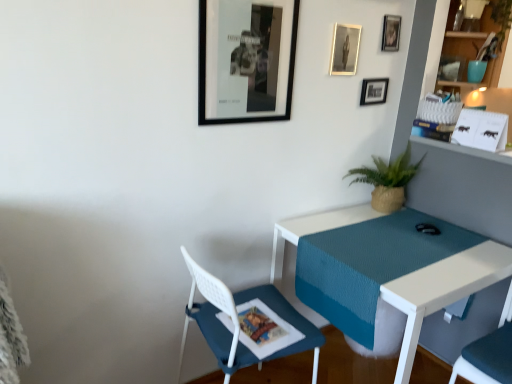
Question: From the image's perspective, is white textured desk at center located beneath black matte picture frame at upper center, the first picture frame when ordered from front to back?

Choices:
 (A) no
 (B) yes

Answer: (B)

Question: Is the depth of white textured desk at center greater than that of black matte picture frame at upper center, the first picture frame when ordered from front to back?

Choices:
 (A) no
 (B) yes

Answer: (A)

Question: Is white textured desk at center not close to black matte picture frame at upper center, which is the 4th picture frame in right-to-left order?

Choices:
 (A) no
 (B) yes

Answer: (A)

Question: Considering the relative sizes of white textured desk at center and black matte picture frame at upper center, which is the 4th picture frame in right-to-left order, in the image provided, is white textured desk at center taller than black matte picture frame at upper center, which is the 4th picture frame in right-to-left order,?

Choices:
 (A) yes
 (B) no

Answer: (A)

Question: Can we say white textured desk at center lies outside black matte picture frame at upper center, the first picture frame when ordered from front to back?

Choices:
 (A) no
 (B) yes

Answer: (B)

Question: In terms of height, does black matte picture frame at upper center, the first picture frame when ordered from front to back, look taller or shorter compared to metallic silver photo frame at upper center, which appears as the 3th picture frame when viewed from the right?

Choices:
 (A) tall
 (B) short

Answer: (A)

Question: Looking at the image, does black matte picture frame at upper center, which is counted as the fourth picture frame, starting from the back, seem bigger or smaller compared to metallic silver photo frame at upper center, acting as the 3th picture frame starting from the back?

Choices:
 (A) small
 (B) big

Answer: (B)

Question: In the image, is black matte picture frame at upper center, the first picture frame when ordered from front to back, on the left side or the right side of metallic silver photo frame at upper center, which ranks as the second picture frame in front-to-back order?

Choices:
 (A) left
 (B) right

Answer: (A)

Question: From a real-world perspective, is black matte picture frame at upper center, the first picture frame when ordered from front to back, positioned above or below metallic silver photo frame at upper center, marked as the second picture frame in a left-to-right arrangement?

Choices:
 (A) below
 (B) above

Answer: (A)

Question: From the image's perspective, relative to metallic silver photo frame at upper center, marked as the second picture frame in a left-to-right arrangement, is teal fabric shelf at upper right above or below?

Choices:
 (A) above
 (B) below

Answer: (A)

Question: From a real-world perspective, is teal fabric shelf at upper right above or below metallic silver photo frame at upper center, marked as the second picture frame in a left-to-right arrangement?

Choices:
 (A) above
 (B) below

Answer: (A)

Question: In the image, is teal fabric shelf at upper right positioned in front of or behind metallic silver photo frame at upper center, which ranks as the second picture frame in front-to-back order?

Choices:
 (A) behind
 (B) front

Answer: (A)

Question: In terms of width, does teal fabric shelf at upper right look wider or thinner when compared to metallic silver photo frame at upper center, marked as the second picture frame in a left-to-right arrangement?

Choices:
 (A) thin
 (B) wide

Answer: (B)

Question: Is teal fabric shelf at upper right inside or outside of black matte picture frame at upper center, positioned as the 1th picture frame in left-to-right order?

Choices:
 (A) inside
 (B) outside

Answer: (B)

Question: Is teal fabric shelf at upper right taller or shorter than black matte picture frame at upper center, which is counted as the fourth picture frame, starting from the back?

Choices:
 (A) short
 (B) tall

Answer: (B)